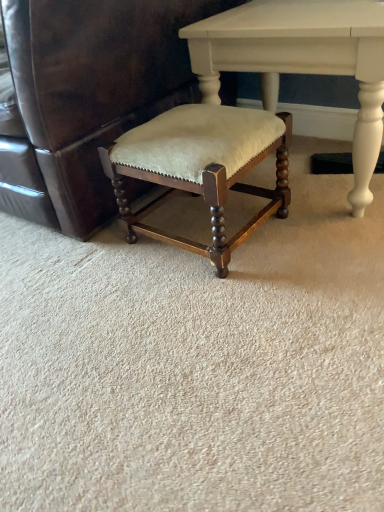
Question: Is velvet beige cushioned stool at center bigger than matte white table at center?

Choices:
 (A) no
 (B) yes

Answer: (B)

Question: From a real-world perspective, is velvet beige cushioned stool at center beneath matte white table at center?

Choices:
 (A) no
 (B) yes

Answer: (A)

Question: From the image's perspective, is velvet beige cushioned stool at center located beneath matte white table at center?

Choices:
 (A) no
 (B) yes

Answer: (A)

Question: Can you confirm if velvet beige cushioned stool at center is wider than matte white table at center?

Choices:
 (A) no
 (B) yes

Answer: (B)

Question: Does velvet beige cushioned stool at center lie behind matte white table at center?

Choices:
 (A) no
 (B) yes

Answer: (A)

Question: Does velvet beige cushioned stool at center appear on the right side of matte white table at center?

Choices:
 (A) yes
 (B) no

Answer: (B)

Question: Is matte white table at center at the left side of velvet beige stool at center?

Choices:
 (A) yes
 (B) no

Answer: (B)

Question: Does matte white table at center have a greater height compared to velvet beige stool at center?

Choices:
 (A) yes
 (B) no

Answer: (A)

Question: From the image's perspective, is matte white table at center located beneath velvet beige stool at center?

Choices:
 (A) no
 (B) yes

Answer: (A)

Question: Can you confirm if matte white table at center is bigger than velvet beige stool at center?

Choices:
 (A) yes
 (B) no

Answer: (A)

Question: Considering the relative positions of matte white table at center and velvet beige stool at center in the image provided, is matte white table at center to the right of velvet beige stool at center from the viewer's perspective?

Choices:
 (A) no
 (B) yes

Answer: (B)

Question: Is the surface of matte white table at center in direct contact with velvet beige stool at center?

Choices:
 (A) no
 (B) yes

Answer: (A)

Question: Does velvet beige stool at center appear on the left side of velvet beige cushioned stool at center?

Choices:
 (A) no
 (B) yes

Answer: (A)